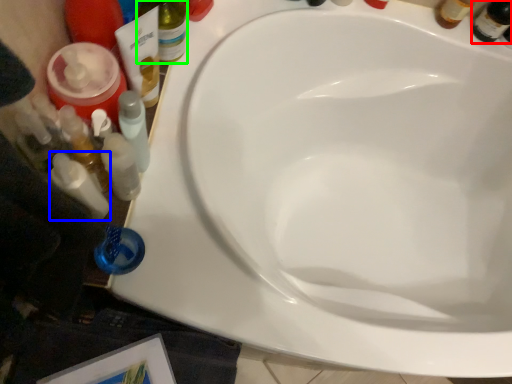
Question: Considering the real-world distances, which object is closest to beer bottle (highlighted by a red box)? toiletry (highlighted by a blue box) or bottle (highlighted by a green box).

Choices:
 (A) toiletry
 (B) bottle

Answer: (B)